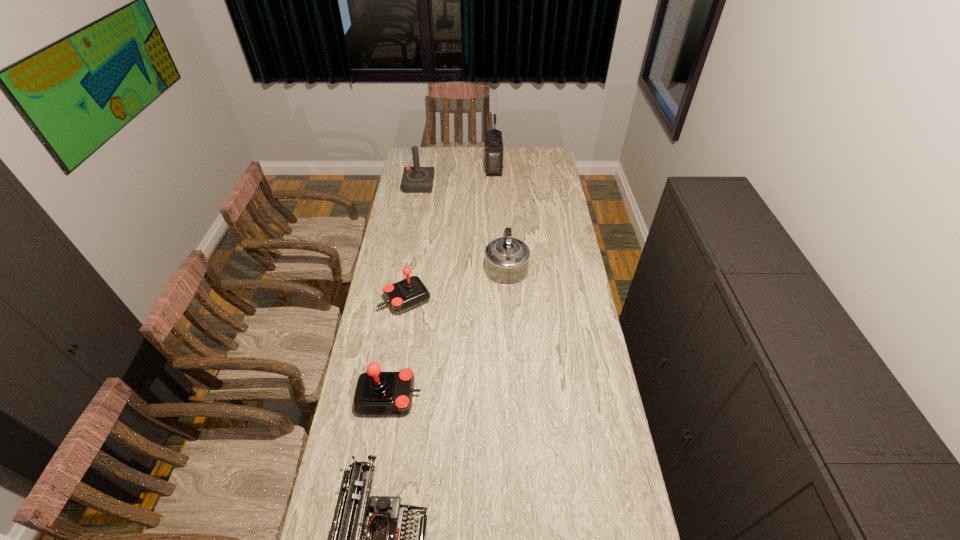
Where is `the tallest object`? Image resolution: width=960 pixels, height=540 pixels. the tallest object is located at coordinates (494, 148).

Where is `the farthest joystick`? the farthest joystick is located at coordinates (416, 179).

At what (x,y) coordinates should I click in order to perform the action: click on kettle. Please return your answer as a coordinate pair (x, y). Looking at the image, I should click on (506, 258).

Identify the location of the second nearest object. (377, 393).

Identify the location of the second farthest joystick. (409, 293).

Where is `free space located on the front-facing side of the lantern`? free space located on the front-facing side of the lantern is located at coordinates (420, 171).

Where is `vacant region located 0.100m on the front-facing side of the lantern`? The width and height of the screenshot is (960, 540). vacant region located 0.100m on the front-facing side of the lantern is located at coordinates (467, 171).

Locate an element on the screen. This screenshot has width=960, height=540. vacant space located 0.180m on the front-facing side of the lantern is located at coordinates (453, 171).

Where is `vacant space located on the rectangular base of the farthest joystick`? The height and width of the screenshot is (540, 960). vacant space located on the rectangular base of the farthest joystick is located at coordinates coord(415,210).

At what (x,y) coordinates should I click in order to perform the action: click on vacant area situated 0.110m with the spout at the front of the kettle. Please return your answer as a coordinate pair (x, y). Looking at the image, I should click on (504, 231).